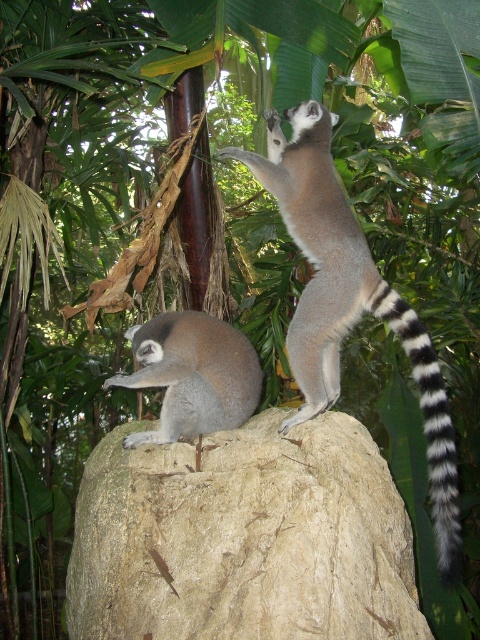
Question: Which of the following is the farthest from the observer?

Choices:
 (A) (371, 584)
 (B) (320, 301)
 (C) (417, 326)

Answer: (B)

Question: In this image, where is ring-tailed lemur at center located relative to black and white striped tail at upper right?

Choices:
 (A) right
 (B) left

Answer: (B)

Question: Considering the real-world distances, which object is farthest from the ring-tailed lemur at center?

Choices:
 (A) black and white striped tail at upper right
 (B) rough textured rock at center
 (C) soft gray fur lemur at center

Answer: (B)

Question: Does rough textured rock at center appear on the right side of soft gray fur lemur at center?

Choices:
 (A) no
 (B) yes

Answer: (B)

Question: Which point is closer to the camera?

Choices:
 (A) rough textured rock at center
 (B) ring-tailed lemur at center
 (C) black and white striped tail at upper right

Answer: (A)

Question: Is soft gray fur lemur at center above black and white striped tail at upper right?

Choices:
 (A) no
 (B) yes

Answer: (B)